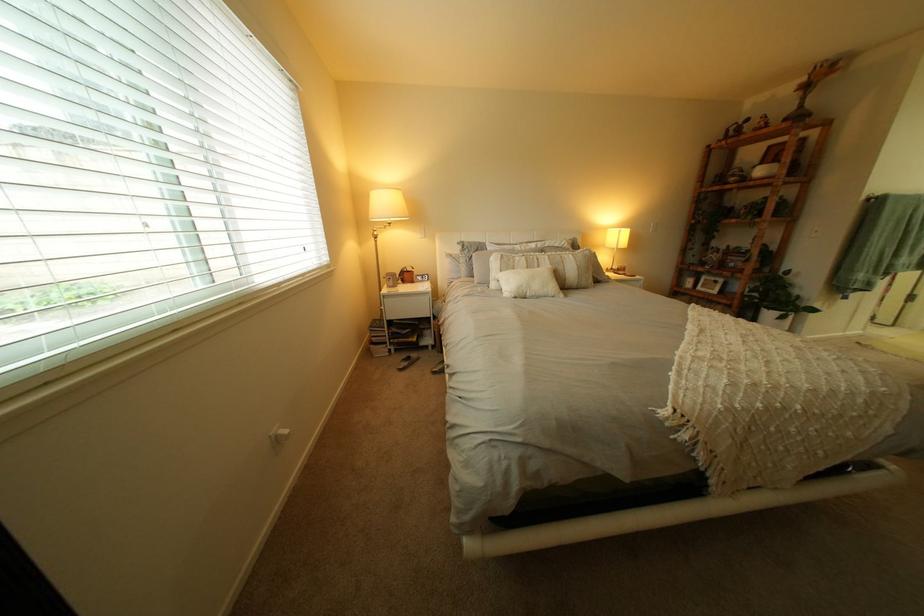
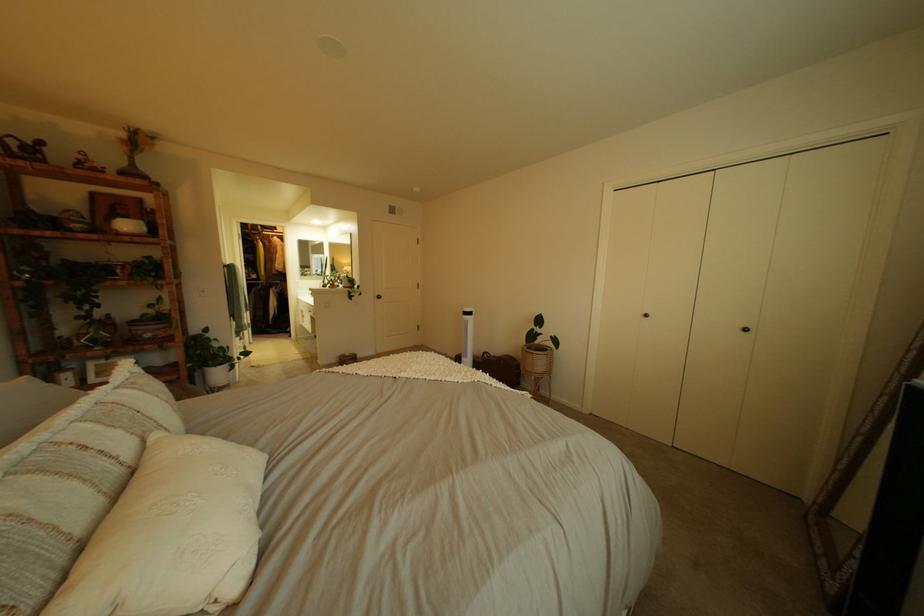
In the second image, find the point that corresponds to point 742,383 in the first image.

(504, 376)